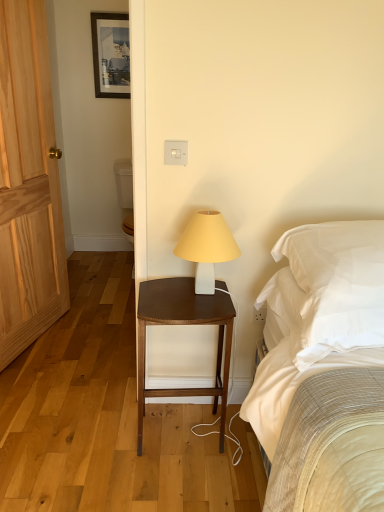
What are the coordinates of `light wood door at left` in the screenshot? It's located at (28, 184).

Image resolution: width=384 pixels, height=512 pixels. Describe the element at coordinates (28, 184) in the screenshot. I see `light wood door at left` at that location.

Measure the distance between white soft pillow at right and camera.

white soft pillow at right and camera are 1.14 meters apart.

Where is `light wood door at left`? light wood door at left is located at coordinates (28, 184).

Is point (206, 250) positioned in front of point (297, 258)?

That is False.

From a real-world perspective, which object rests below the other?

white matte lamp at center, from a real-world perspective.

Between white matte lamp at center and white soft pillow at right, which one has larger size?

Bigger between the two is white soft pillow at right.

Image resolution: width=384 pixels, height=512 pixels. I want to click on picture frame behind the white matte lamp at center, so click(x=111, y=54).

Which point is more distant from viewer, (127, 35) or (205, 256)?

The point (127, 35) is behind.

How different are the orientations of matte black picture frame at upper center and white matte lamp at center in degrees?

There is a 2.06-degree angle between the facing directions of matte black picture frame at upper center and white matte lamp at center.

Is matte black picture frame at upper center bigger or smaller than white matte lamp at center?

In the image, matte black picture frame at upper center appears to be smaller than white matte lamp at center.

Is white matte lamp at center looking in the opposite direction of brown wood nightstand at center?

No, brown wood nightstand at center is not at the back of white matte lamp at center.

Is point (204, 249) more distant than point (204, 309)?

That is False.

Is brown wood nightstand at center located within white matte lamp at center?

Actually, brown wood nightstand at center is outside white matte lamp at center.

Is white soft pillow at right inside the boundaries of matte black picture frame at upper center, or outside?

white soft pillow at right cannot be found inside matte black picture frame at upper center.

Is white soft pillow at right in contact with matte black picture frame at upper center?

No, white soft pillow at right is not in contact with matte black picture frame at upper center.

Is white soft pillow at right at the right side of matte black picture frame at upper center?

Yes, white soft pillow at right is to the right of matte black picture frame at upper center.

Is point (186, 283) positioned before point (45, 67)?

Yes, it is in front of point (45, 67).

Is brown wood nightstand at center facing towards light wood door at left?

No, brown wood nightstand at center is not oriented towards light wood door at left.

Where is `door on the left of brown wood nightstand at center`? This screenshot has height=512, width=384. door on the left of brown wood nightstand at center is located at coordinates (28, 184).

Considering the sizes of objects brown wood nightstand at center and light wood door at left in the image provided, who is taller, brown wood nightstand at center or light wood door at left?

With more height is light wood door at left.

What's the angular difference between white soft pillow at right and light wood door at left's facing directions?

white soft pillow at right and light wood door at left are facing 69.8 degrees away from each other.

Does white soft pillow at right turn towards light wood door at left?

No, white soft pillow at right is not oriented towards light wood door at left.

From a real-world perspective, is white soft pillow at right above or below light wood door at left?

In terms of real-world spatial position, white soft pillow at right is below light wood door at left.

Is point (383, 300) less distant than point (4, 88)?

That is True.

Considering the positions of points (10, 220) and (218, 211), is point (10, 220) closer to camera compared to point (218, 211)?

No.

Which of these two, light wood door at left or white matte lamp at center, stands taller?

Standing taller between the two is light wood door at left.

Would you say white matte lamp at center is part of light wood door at left's contents?

No, white matte lamp at center is not inside light wood door at left.

Is light wood door at left at the right side of white matte lamp at center?

No.

Where is `lamp on the left of white soft pillow at right`? The height and width of the screenshot is (512, 384). lamp on the left of white soft pillow at right is located at coordinates (207, 247).

Identify the location of lamp on the right of matte black picture frame at upper center. Image resolution: width=384 pixels, height=512 pixels. click(x=207, y=247).

Estimate the real-world distances between objects in this image. Which object is closer to white soft pillow at right, white matte lamp at center or matte black picture frame at upper center?

Based on the image, white matte lamp at center appears to be nearer to white soft pillow at right.

Estimate the real-world distances between objects in this image. Which object is further from white matte lamp at center, white soft pillow at right or matte black picture frame at upper center?

matte black picture frame at upper center lies further to white matte lamp at center than the other object.

When comparing their distances from light wood door at left, does matte black picture frame at upper center or white soft pillow at right seem closer?

matte black picture frame at upper center is positioned closer to the anchor light wood door at left.

Looking at the image, which one is located closer to white matte lamp at center, matte black picture frame at upper center or white soft pillow at right?

white soft pillow at right is positioned closer to the anchor white matte lamp at center.

From the picture: Which object lies nearer to the anchor point matte black picture frame at upper center, white soft pillow at right or white matte lamp at center?

Based on the image, white matte lamp at center appears to be nearer to matte black picture frame at upper center.

Looking at the image, which one is located closer to white soft pillow at right, light wood door at left or brown wood nightstand at center?

brown wood nightstand at center.

Which object lies further to the anchor point light wood door at left, brown wood nightstand at center or matte black picture frame at upper center?

matte black picture frame at upper center is positioned further to the anchor light wood door at left.

When comparing their distances from white matte lamp at center, does light wood door at left or white soft pillow at right seem closer?

white soft pillow at right lies closer to white matte lamp at center than the other object.

Where is `lamp between light wood door at left and white soft pillow at right from left to right`? The width and height of the screenshot is (384, 512). lamp between light wood door at left and white soft pillow at right from left to right is located at coordinates (207, 247).

The width and height of the screenshot is (384, 512). What are the coordinates of `door between white soft pillow at right and matte black picture frame at upper center from front to back` in the screenshot? It's located at (28, 184).

You are a GUI agent. You are given a task and a screenshot of the screen. Output one action in this format:
    pyautogui.click(x=<x>, y=<y>)
    Task: Click on the door between matte black picture frame at upper center and brown wood nightstand at center in the up-down direction
    
    Given the screenshot: What is the action you would take?
    pyautogui.click(x=28, y=184)

The width and height of the screenshot is (384, 512). What are the coordinates of `lamp between matte black picture frame at upper center and brown wood nightstand at center from top to bottom` in the screenshot? It's located at (207, 247).